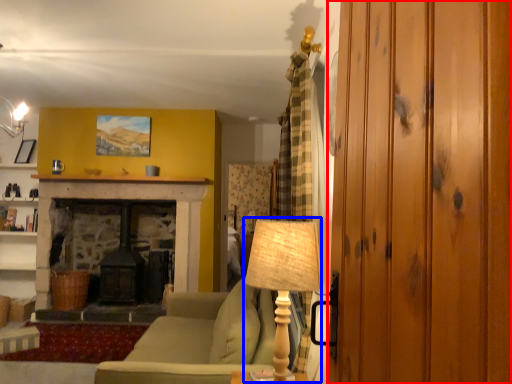
Question: Which object is further to the camera taking this photo, glass door (highlighted by a red box) or table lamp (highlighted by a blue box)?

Choices:
 (A) glass door
 (B) table lamp

Answer: (B)